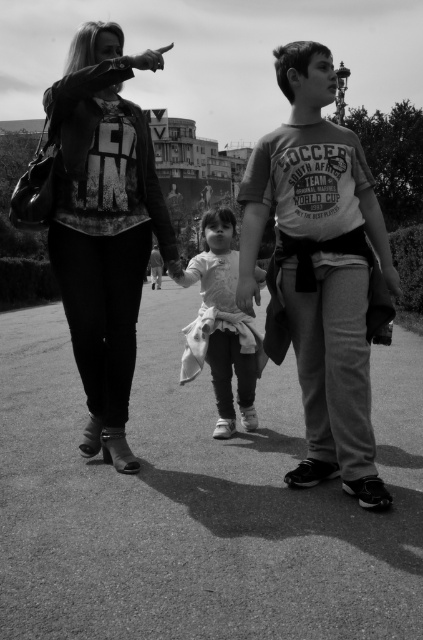
Can you confirm if matte gray t-shirt at center is positioned to the right of white cotton dress at center?

Indeed, matte gray t-shirt at center is positioned on the right side of white cotton dress at center.

Who is higher up, matte gray t-shirt at center or white cotton dress at center?

Positioned higher is matte gray t-shirt at center.

Is point (351, 234) farther from camera compared to point (208, 259)?

That is False.

Image resolution: width=423 pixels, height=640 pixels. I want to click on matte gray t-shirt at center, so click(x=320, y=268).

Who is positioned more to the right, white cotton dress at center or matte gray hoodie at center?

white cotton dress at center is more to the right.

Describe the element at coordinates (222, 326) in the screenshot. I see `white cotton dress at center` at that location.

I want to click on white cotton dress at center, so click(222, 326).

Is point (76, 256) positioned before point (159, 259)?

Yes, point (76, 256) is closer to viewer.

Is matte black jacket at left smaller than matte gray hoodie at center?

Yes.

Is point (87, 72) positioned behind point (158, 280)?

No, (87, 72) is in front of (158, 280).

Find the location of `matte black jacket at left`. matte black jacket at left is located at coordinates (104, 225).